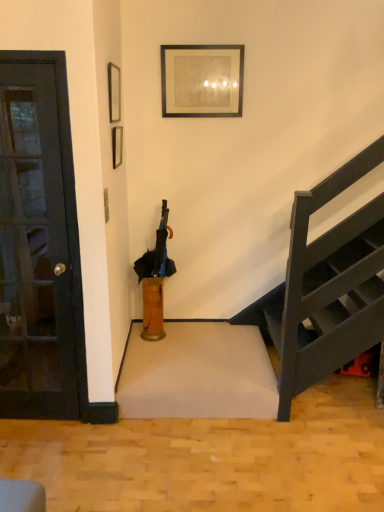
Locate an element on the screen. The height and width of the screenshot is (512, 384). blank space situated above black matte picture frame at upper center, the first picture frame positioned from the back (from a real-world perspective) is located at coordinates (209, 40).